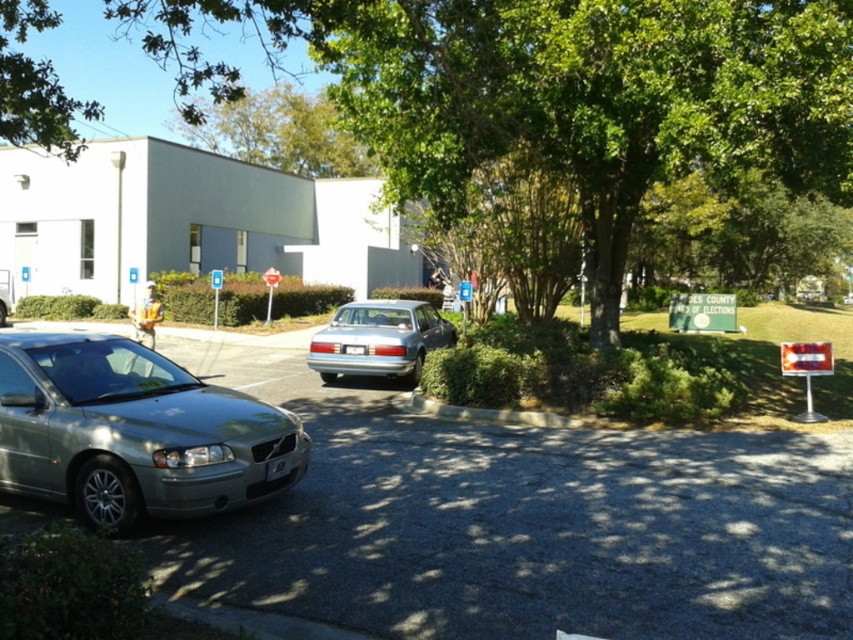
Can you confirm if satin silver car at lower left is thinner than satin silver sedan at center?

Incorrect, satin silver car at lower left's width is not less than satin silver sedan at center's.

Does satin silver car at lower left appear under satin silver sedan at center?

Yes, satin silver car at lower left is below satin silver sedan at center.

Find the location of a particular element. The height and width of the screenshot is (640, 853). satin silver car at lower left is located at coordinates (134, 433).

Which is behind, point (33, 429) or point (277, 136)?

Positioned behind is point (277, 136).

Measure the distance between satin silver car at lower left and camera.

satin silver car at lower left and camera are 17.18 feet apart from each other.

This screenshot has width=853, height=640. I want to click on satin silver car at lower left, so click(134, 433).

Based on the photo, can you confirm if silver metallic car at lower left is bigger than green leafy tree at center?

No, silver metallic car at lower left is not bigger than green leafy tree at center.

Find the location of a particular element. silver metallic car at lower left is located at coordinates (520, 522).

The image size is (853, 640). I want to click on silver metallic car at lower left, so click(520, 522).